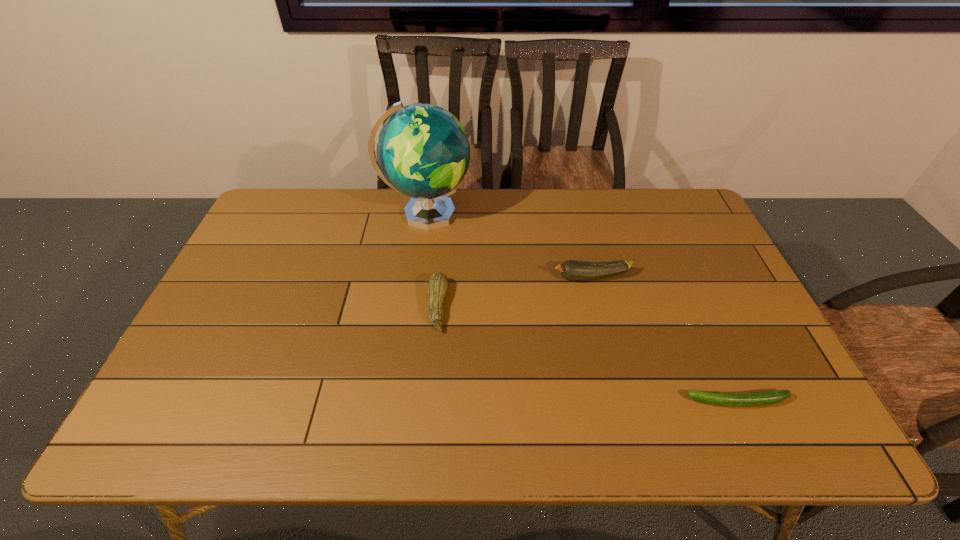
Locate an element on the screen. This screenshot has width=960, height=540. blank space located at the stem end of the leftmost zucchini is located at coordinates (568, 306).

Find the location of a particular element. The height and width of the screenshot is (540, 960). free space located on the front-facing side of the nearest object is located at coordinates (520, 401).

This screenshot has height=540, width=960. In order to click on blank area located on the front-facing side of the nearest object in this screenshot , I will do `click(630, 401)`.

Locate an element on the screen. This screenshot has height=540, width=960. free space located 0.230m on the front-facing side of the nearest object is located at coordinates (586, 401).

You are a GUI agent. You are given a task and a screenshot of the screen. Output one action in this format:
    pyautogui.click(x=<x>, y=<y>)
    Task: Click on the object positioned at the far edge
    The height and width of the screenshot is (540, 960).
    Given the screenshot: What is the action you would take?
    pyautogui.click(x=423, y=151)

Identify the location of object at the near edge. (752, 399).

The height and width of the screenshot is (540, 960). Find the location of `object at the right edge`. object at the right edge is located at coordinates (752, 399).

I want to click on object that is at the near right corner, so click(x=752, y=399).

Locate an element on the screen. free space at the far edge of the desktop is located at coordinates (473, 223).

In the image, there is a desktop. Identify the location of vacant space at the near edge. The image size is (960, 540). (352, 437).